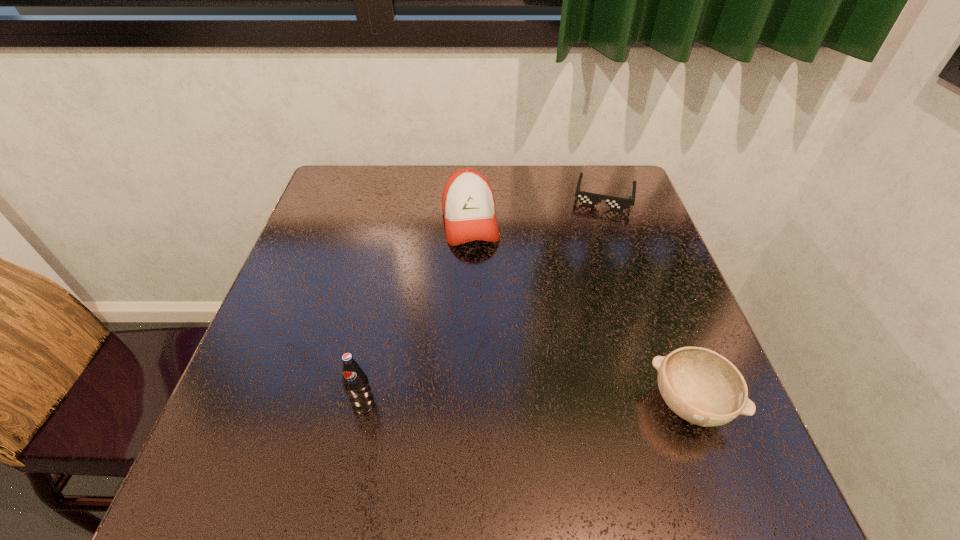
Find the location of `vacant space on the desktop that is between the leftmost object and the second shortest object and is positioned on the front-facing side of the third shortest object`. vacant space on the desktop that is between the leftmost object and the second shortest object and is positioned on the front-facing side of the third shortest object is located at coordinates (505, 404).

This screenshot has width=960, height=540. In order to click on vacant space on the desktop that is between the pop and the bowl and is positioned on the front-facing side of the shortest object in this screenshot , I will do (x=569, y=404).